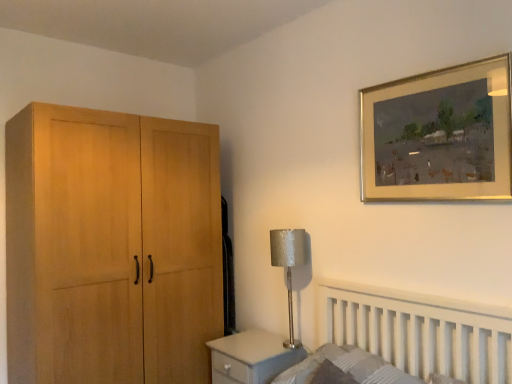
Question: Is gold-framed painting at upper right shorter than textured gray mattress at lower right?

Choices:
 (A) no
 (B) yes

Answer: (A)

Question: From the image's perspective, is gold-framed painting at upper right above textured gray mattress at lower right?

Choices:
 (A) yes
 (B) no

Answer: (A)

Question: Is the position of gold-framed painting at upper right less distant than that of textured gray mattress at lower right?

Choices:
 (A) no
 (B) yes

Answer: (A)

Question: Does gold-framed painting at upper right have a lesser width compared to textured gray mattress at lower right?

Choices:
 (A) yes
 (B) no

Answer: (A)

Question: Considering the relative sizes of gold-framed painting at upper right and textured gray mattress at lower right in the image provided, is gold-framed painting at upper right smaller than textured gray mattress at lower right?

Choices:
 (A) yes
 (B) no

Answer: (A)

Question: From a real-world perspective, is gold-framed painting at upper right physically below textured gray mattress at lower right?

Choices:
 (A) yes
 (B) no

Answer: (B)

Question: Is textured gray mattress at lower right placed right next to silver textured lampshade at center-right?

Choices:
 (A) no
 (B) yes

Answer: (A)

Question: From the image's perspective, is textured gray mattress at lower right on top of silver textured lampshade at center-right?

Choices:
 (A) yes
 (B) no

Answer: (B)

Question: Considering the relative sizes of textured gray mattress at lower right and silver textured lampshade at center-right in the image provided, is textured gray mattress at lower right bigger than silver textured lampshade at center-right?

Choices:
 (A) no
 (B) yes

Answer: (B)

Question: Can you confirm if textured gray mattress at lower right is thinner than silver textured lampshade at center-right?

Choices:
 (A) yes
 (B) no

Answer: (B)

Question: Considering the relative sizes of textured gray mattress at lower right and silver textured lampshade at center-right in the image provided, is textured gray mattress at lower right taller than silver textured lampshade at center-right?

Choices:
 (A) no
 (B) yes

Answer: (A)

Question: Would you say textured gray mattress at lower right is outside silver textured lampshade at center-right?

Choices:
 (A) no
 (B) yes

Answer: (B)

Question: Is textured gray mattress at lower right aimed at gold-framed painting at upper right?

Choices:
 (A) no
 (B) yes

Answer: (A)